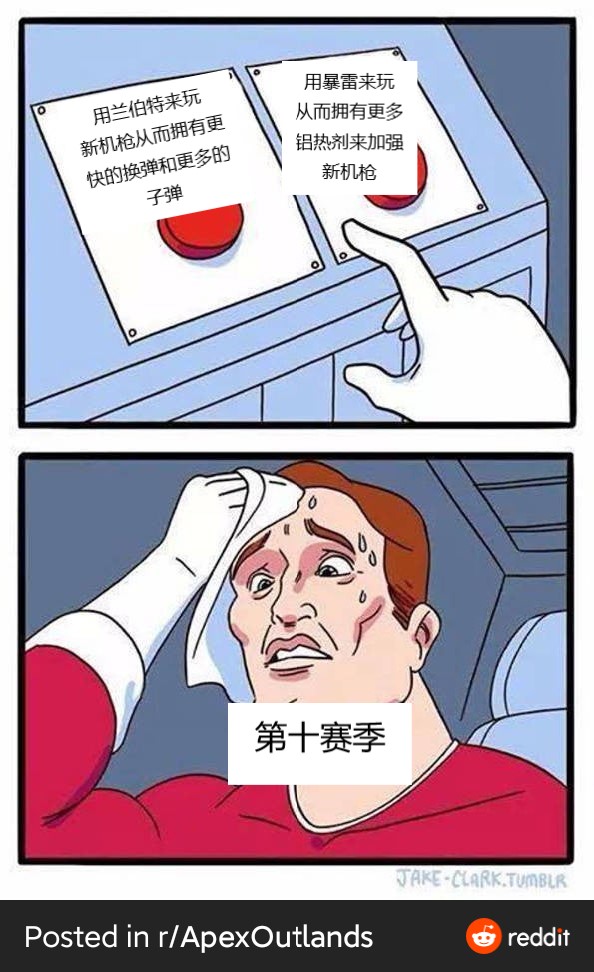
This screenshot has height=972, width=594. Identify the location of notes. (388, 122), (183, 167).